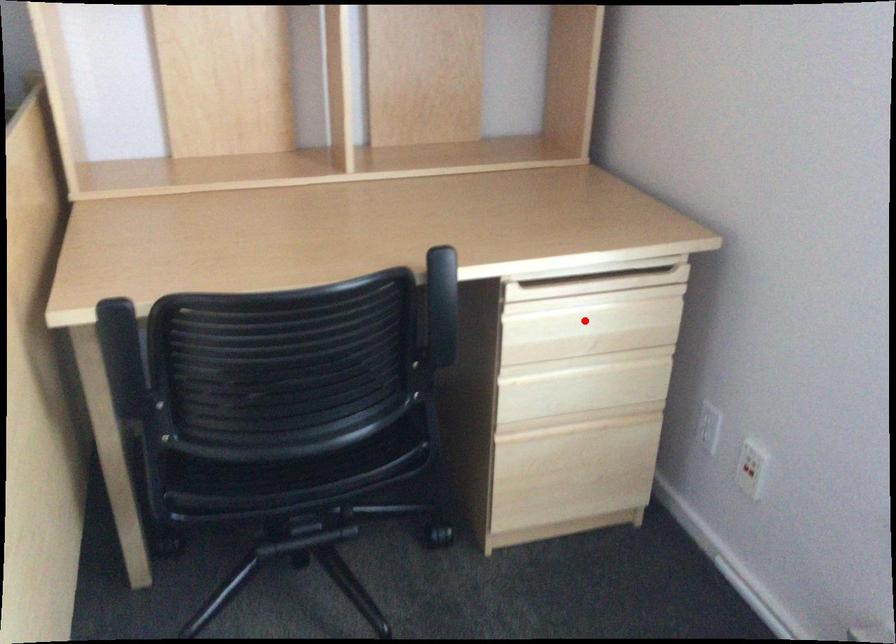
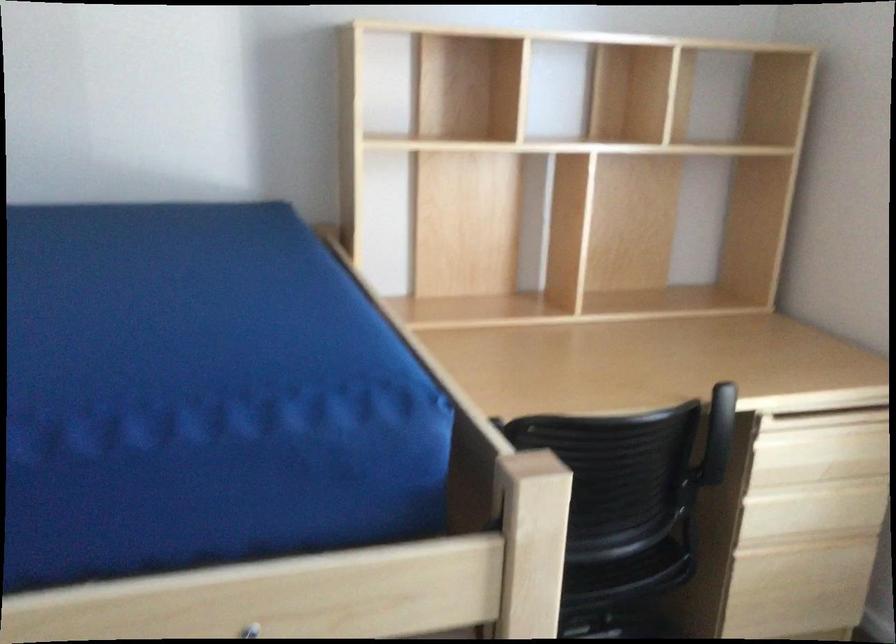
Where in the second image is the point corresponding to the highlighted location from the first image?

(819, 450)